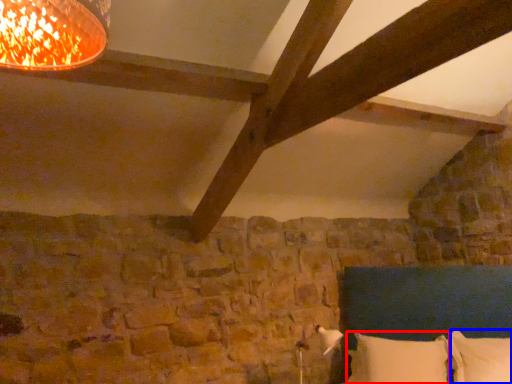
Question: Which object appears closest to the camera in this image, pillow (highlighted by a red box) or pillow (highlighted by a blue box)?

Choices:
 (A) pillow
 (B) pillow

Answer: (B)